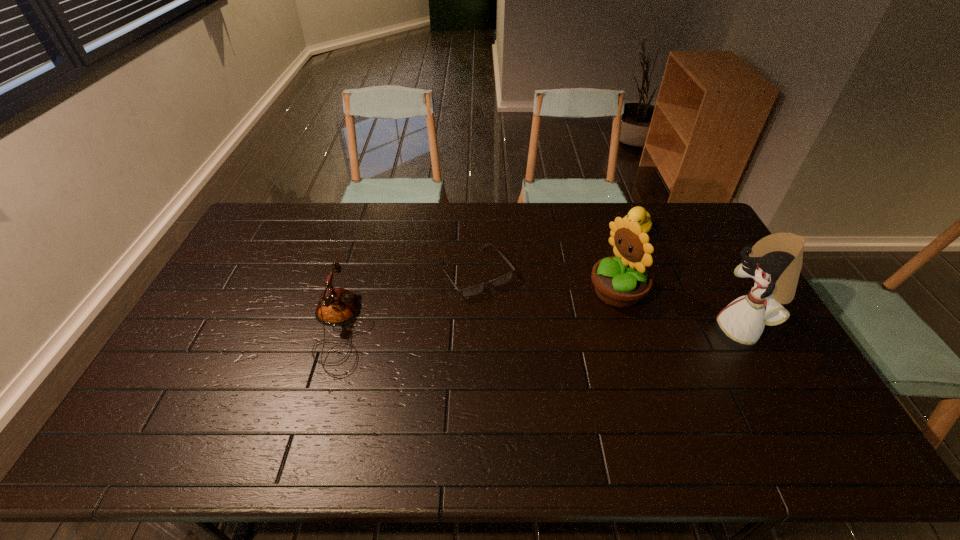
This screenshot has height=540, width=960. Identify the location of telephone. (337, 306).

In order to click on doll in this screenshot , I will do `click(775, 262)`.

Find the location of a particular element. The image size is (960, 540). the tallest object is located at coordinates (775, 262).

The width and height of the screenshot is (960, 540). Find the location of `the second tallest object`. the second tallest object is located at coordinates (620, 281).

Identify the location of the second object from left to right. (477, 289).

The height and width of the screenshot is (540, 960). In order to click on spectacles in this screenshot , I will do `click(477, 289)`.

I want to click on duckling, so click(x=639, y=214).

Find the location of a particular element. This screenshot has width=960, height=540. free space located on the rotary dial of the leftmost object is located at coordinates (492, 329).

Identify the location of vacant region located 0.120m at the front face of the rightmost object. The height and width of the screenshot is (540, 960). (677, 329).

I want to click on free point located 0.190m at the front face of the rightmost object, so click(x=653, y=329).